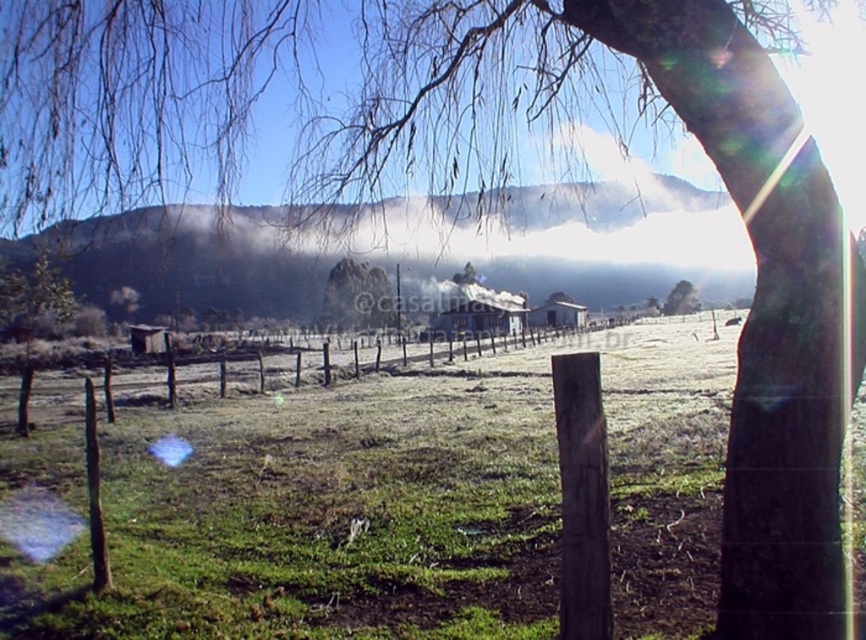
Question: Which of the following is the closest to the observer?

Choices:
 (A) (677, 300)
 (B) (344, 296)
 (C) (40, 285)
 (D) (364, 378)

Answer: (D)

Question: Does green matte tree at left have a lesser width compared to green matte tree at center?

Choices:
 (A) no
 (B) yes

Answer: (B)

Question: Among these points, which one is nearest to the camera?

Choices:
 (A) pos(241,362)
 (B) pos(686,310)

Answer: (A)

Question: Is brown wooden fence at center above green matte tree at left?

Choices:
 (A) no
 (B) yes

Answer: (A)

Question: Which point is farther to the camera?

Choices:
 (A) green matte tree at center
 (B) green matte tree at left
 (C) smooth gray rock at center

Answer: (A)

Question: Does brown wooden fence at center appear under smooth gray rock at center?

Choices:
 (A) yes
 (B) no

Answer: (A)